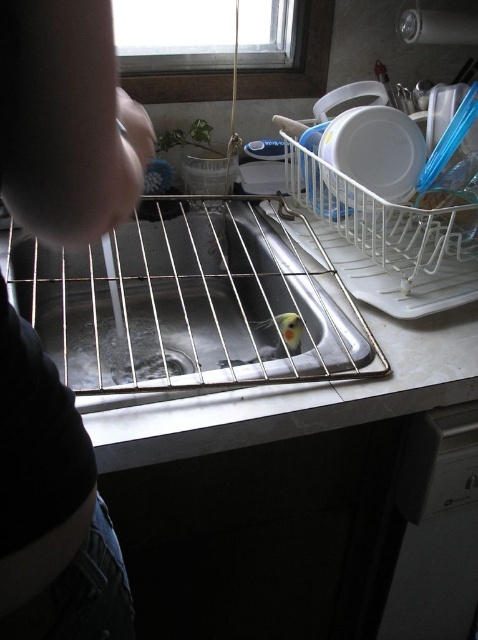
You are trying to decide where to place a new tall kitchen appliance. The appliance is 1 meter in height. Given the stainless steel sink at center and the white plastic dishwasher at lower right, which one can accommodate the appliance in terms of height?

The white plastic dishwasher at lower right is taller than the stainless steel sink at center. Since the appliance is 1 meter tall, it can only be placed where the dishwasher is located if the dishwasher is at least 1 meter in height. However, the description only states that the dishwasher is taller than the sink, but does not provide exact measurements. Therefore, it is uncertain if the dishwasher can accommodate the appliance without more specific information.

You are standing in the kitchen and need to place a new dish rack. The current dish rack is to the right of the stainless steel sink at center. Where should you place the new dish rack to avoid blocking the sink?

Place the new dish rack to the left of the stainless steel sink at center to avoid blocking it, since the current dish rack is already on the right side.